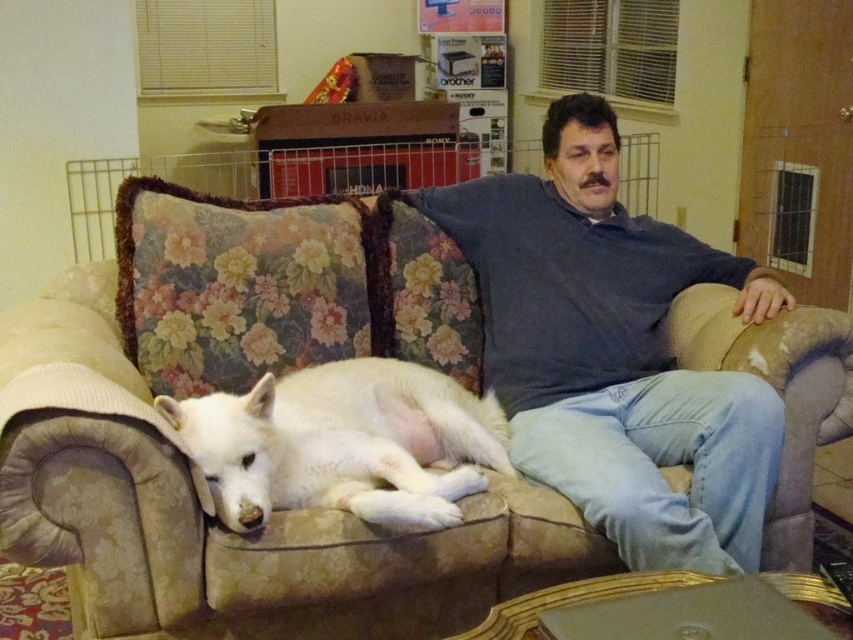
You are a tailor measuring the distance between the beige floral couch at center and the blue cotton shirt at center for a fitting. The minimum required distance for accurate measurements is 16 inches. Can the tailor proceed with the current distance?

The beige floral couch at center is 15.64 inches from blue cotton shirt at center. Since the required distance is 16 inches, the tailor cannot proceed with the current distance as it is slightly shorter than needed.

In the scene shown: You are a fashion designer who wants to create a new outfit for the man in the scene. You notice the blue cotton shirt at center and the white fur dog at center. Which object is located to the right of the other?

The blue cotton shirt at center is positioned on the right side of white fur dog at center, so the blue cotton shirt at center is to the right of the white fur dog at center.

You are a photographer taking a picture of the beige floral couch at center and the blue cotton shirt at center. Which object will appear larger in the photo?

The beige floral couch at center will appear larger in the photo because it is closer to the viewer than the blue cotton shirt at center.